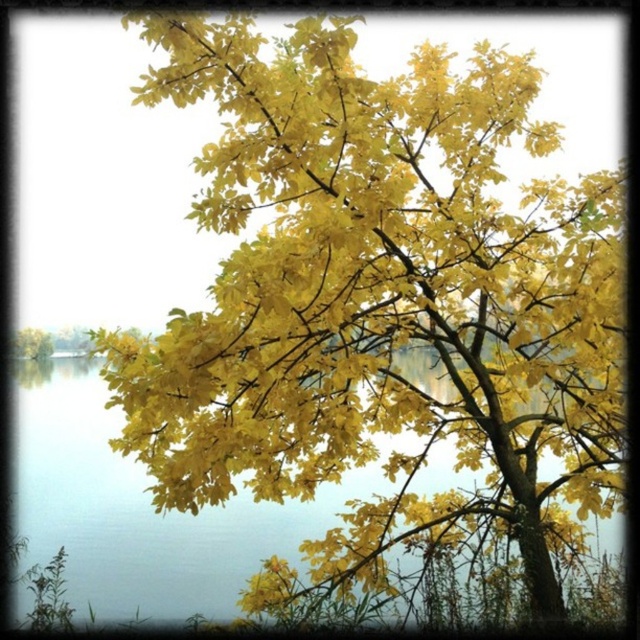
How far apart are transparent water at center and yellow matte tree at left?

transparent water at center is 26.90 inches from yellow matte tree at left.

Is transparent water at center to the right of yellow matte tree at left from the viewer's perspective?

Correct, you'll find transparent water at center to the right of yellow matte tree at left.

Which is in front, point (124, 528) or point (38, 340)?

Positioned in front is point (124, 528).

Where is `transparent water at center`? The height and width of the screenshot is (640, 640). transparent water at center is located at coordinates (131, 512).